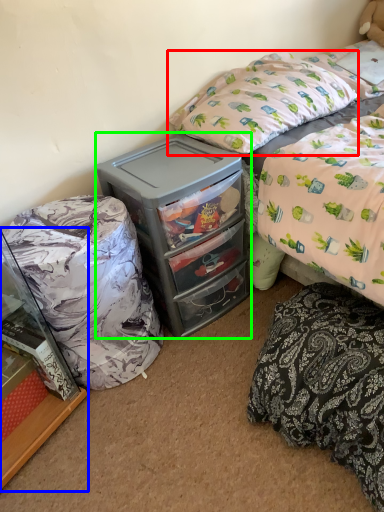
Question: Which is farther away from pillow (highlighted by a red box)? cabinetry (highlighted by a blue box) or chest of drawers (highlighted by a green box)?

Choices:
 (A) cabinetry
 (B) chest of drawers

Answer: (A)